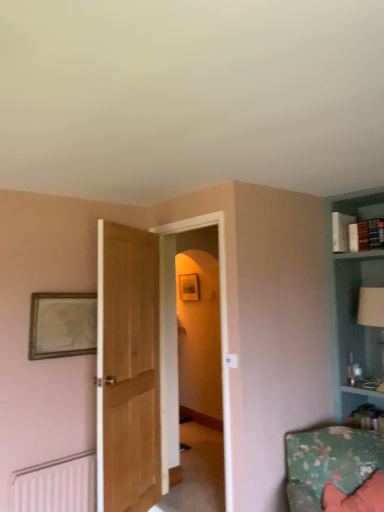
In order to click on light brown wood door at center in this screenshot , I will do `click(128, 369)`.

The height and width of the screenshot is (512, 384). What do you see at coordinates (56, 485) in the screenshot?
I see `white matte radiator at lower left` at bounding box center [56, 485].

This screenshot has width=384, height=512. I want to click on light brown wood door at center, so click(128, 369).

Is floral fabric cushion at lower right looking in the opposite direction of white glossy table lamp at upper right?

That's not correct — floral fabric cushion at lower right is not looking away from white glossy table lamp at upper right.

Between floral fabric cushion at lower right and white glossy table lamp at upper right, which one is positioned behind?

Positioned behind is white glossy table lamp at upper right.

From a real-world perspective, who is located higher, floral fabric cushion at lower right or white glossy table lamp at upper right?

white glossy table lamp at upper right is physically above.

Is white matte radiator at lower left located within transparent glass door at center?

No, white matte radiator at lower left is not inside transparent glass door at center.

From a real-world perspective, is transparent glass door at center positioned above or below white matte radiator at lower left?

transparent glass door at center is above white matte radiator at lower left.

Consider the image. Which object is wider, transparent glass door at center or light brown wood door at center?

With larger width is transparent glass door at center.

Considering the relative sizes of transparent glass door at center and light brown wood door at center in the image provided, is transparent glass door at center shorter than light brown wood door at center?

Incorrect, the height of transparent glass door at center does not fall short of that of light brown wood door at center.

Visually, is transparent glass door at center positioned to the left or to the right of light brown wood door at center?

Clearly, transparent glass door at center is on the right of light brown wood door at center in the image.

How far apart are transparent glass door at center and light brown wood door at center?

transparent glass door at center is 23.09 inches away from light brown wood door at center.

From the image's perspective, which one is positioned lower, wooden picture frame at upper left or light brown wood door at center?

From the image's view, light brown wood door at center is below.

Does point (59, 317) appear closer or farther from the camera than point (98, 417)?

Point (59, 317) is farther from the camera than point (98, 417).

Is wooden picture frame at upper left taller or shorter than light brown wood door at center?

wooden picture frame at upper left is shorter than light brown wood door at center.

Based on the photo, is white matte radiator at lower left beside white glossy table lamp at upper right?

They are not placed beside each other.

Looking at the image, does white matte radiator at lower left seem bigger or smaller compared to white glossy table lamp at upper right?

In the image, white matte radiator at lower left appears to be smaller than white glossy table lamp at upper right.

From the image's perspective, is white matte radiator at lower left above white glossy table lamp at upper right?

No.

What's the angular difference between white matte radiator at lower left and white glossy table lamp at upper right's facing directions?

The angular difference between white matte radiator at lower left and white glossy table lamp at upper right is 88.6 degrees.

Which is more to the right, transparent glass door at center or white glossy table lamp at upper right?

From the viewer's perspective, white glossy table lamp at upper right appears more on the right side.

From a real-world perspective, relative to white glossy table lamp at upper right, is transparent glass door at center vertically above or below?

transparent glass door at center is below white glossy table lamp at upper right.

Is transparent glass door at center oriented towards white glossy table lamp at upper right?

No, transparent glass door at center is not facing towards white glossy table lamp at upper right.

How far apart are transparent glass door at center and white glossy table lamp at upper right?

The distance of transparent glass door at center from white glossy table lamp at upper right is 3.55 feet.

How far apart are light brown wood door at center and transparent glass door at center?

The distance of light brown wood door at center from transparent glass door at center is 23.09 inches.

Considering the relative sizes of light brown wood door at center and transparent glass door at center in the image provided, is light brown wood door at center shorter than transparent glass door at center?

Yes.

From the image's perspective, which object appears higher, light brown wood door at center or transparent glass door at center?

transparent glass door at center appears higher in the image.

Is transparent glass door at center at the back of light brown wood door at center?

Absolutely, light brown wood door at center is directed away from transparent glass door at center.

Where is `table lamp that is on the right side of floral fabric cushion at lower right`? table lamp that is on the right side of floral fabric cushion at lower right is located at coordinates (371, 307).

In order to click on radiator in front of the transparent glass door at center in this screenshot , I will do `click(56, 485)`.

Looking at the image, which one is located further to white matte radiator at lower left, white glossy table lamp at upper right or light brown wood door at center?

white glossy table lamp at upper right.

Which object lies nearer to the anchor point white matte radiator at lower left, floral fabric cushion at lower right or white glossy table lamp at upper right?

The object closer to white matte radiator at lower left is floral fabric cushion at lower right.

Which object lies nearer to the anchor point wooden picture frame at upper left, floral fabric cushion at lower right or white glossy table lamp at upper right?

floral fabric cushion at lower right is closer to wooden picture frame at upper left.

Considering their positions, is wooden picture frame at upper left positioned closer to floral fabric cushion at lower right than white matte radiator at lower left?

white matte radiator at lower left lies closer to floral fabric cushion at lower right than the other object.

When comparing their distances from transparent glass door at center, does floral fabric cushion at lower right or white glossy table lamp at upper right seem closer?

floral fabric cushion at lower right is positioned closer to the anchor transparent glass door at center.

Looking at the image, which one is located further to light brown wood door at center, transparent glass door at center or white matte radiator at lower left?

transparent glass door at center is positioned further to the anchor light brown wood door at center.

Estimate the real-world distances between objects in this image. Which object is further from transparent glass door at center, white glossy table lamp at upper right or wooden picture frame at upper left?

white glossy table lamp at upper right lies further to transparent glass door at center than the other object.

Considering their positions, is light brown wood door at center positioned further to white glossy table lamp at upper right than floral fabric cushion at lower right?

light brown wood door at center is positioned further to the anchor white glossy table lamp at upper right.

I want to click on picture frame located between white matte radiator at lower left and floral fabric cushion at lower right in the left-right direction, so coord(62,325).

This screenshot has width=384, height=512. I want to click on door situated between wooden picture frame at upper left and transparent glass door at center from left to right, so click(x=128, y=369).

This screenshot has width=384, height=512. Find the location of `armchair located between wooden picture frame at upper left and white glossy table lamp at upper right in the left-right direction`. armchair located between wooden picture frame at upper left and white glossy table lamp at upper right in the left-right direction is located at coordinates (329, 463).

You are a GUI agent. You are given a task and a screenshot of the screen. Output one action in this format:
    pyautogui.click(x=<x>, y=<y>)
    Task: Click on the glass door located between white matte radiator at lower left and white glossy table lamp at upper right in the left-right direction
    The height and width of the screenshot is (512, 384).
    Given the screenshot: What is the action you would take?
    pyautogui.click(x=220, y=326)